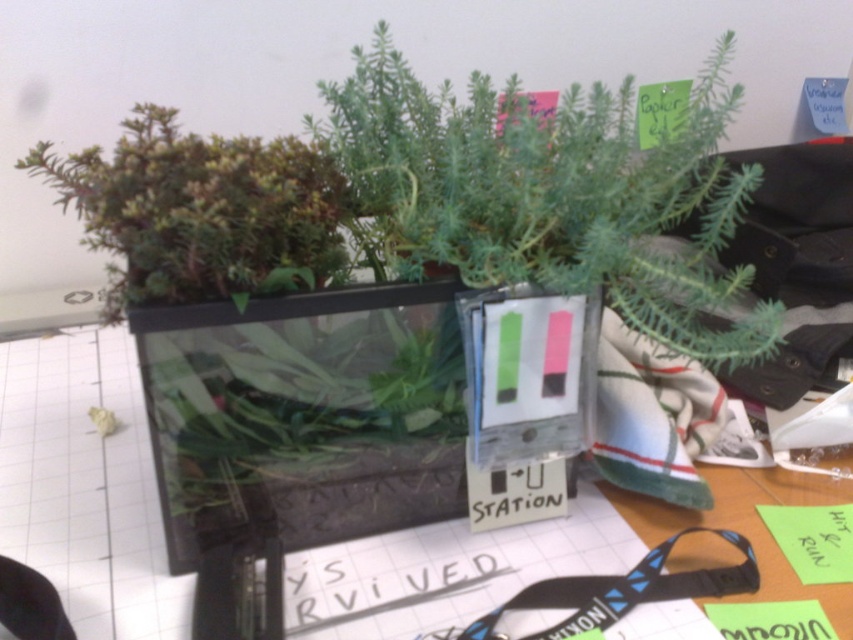
Consider the image. Can you confirm if green matte plant at center is thinner than green matte plant at upper left?

In fact, green matte plant at center might be wider than green matte plant at upper left.

Is green matte plant at center positioned at the back of green matte plant at upper left?

Yes, green matte plant at center is behind green matte plant at upper left.

Who is more distant from viewer, [622,276] or [164,240]?

Answer: The point [622,276] is more distant.

You are a GUI agent. You are given a task and a screenshot of the screen. Output one action in this format:
    pyautogui.click(x=<x>, y=<y>)
    Task: Click on the green matte plant at center
    
    Given the screenshot: What is the action you would take?
    pyautogui.click(x=552, y=192)